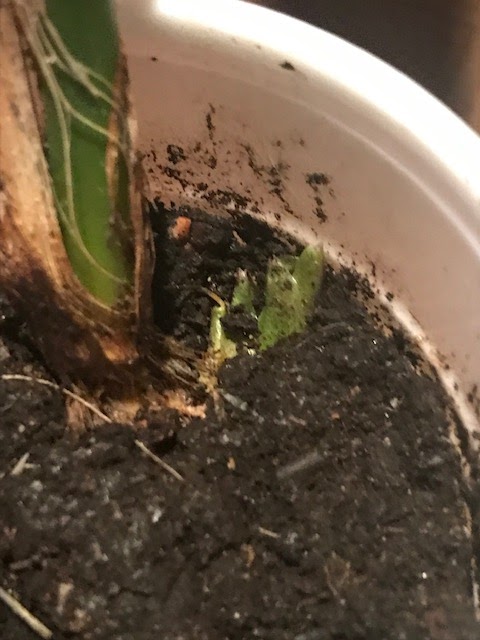
Locate an element on the screen. plant pot is located at coordinates (394, 114).